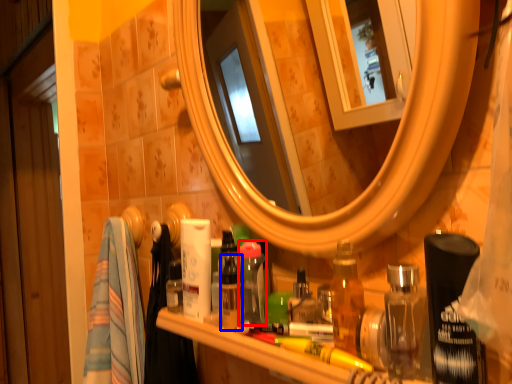
Question: Which object is further to the camera taking this photo, toiletry (highlighted by a red box) or toiletry (highlighted by a blue box)?

Choices:
 (A) toiletry
 (B) toiletry

Answer: (A)